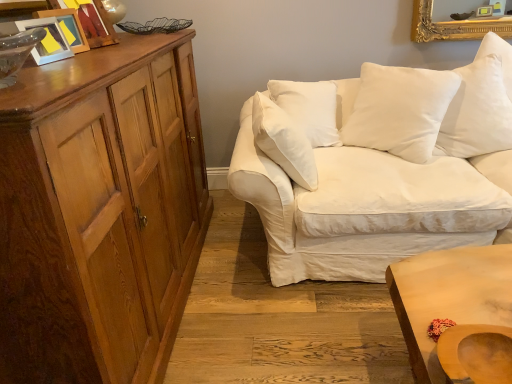
Find the location of a particular element. Image resolution: width=512 pixels, height=384 pixels. free spot above light brown wooden table at lower right (from a real-world perspective) is located at coordinates (464, 283).